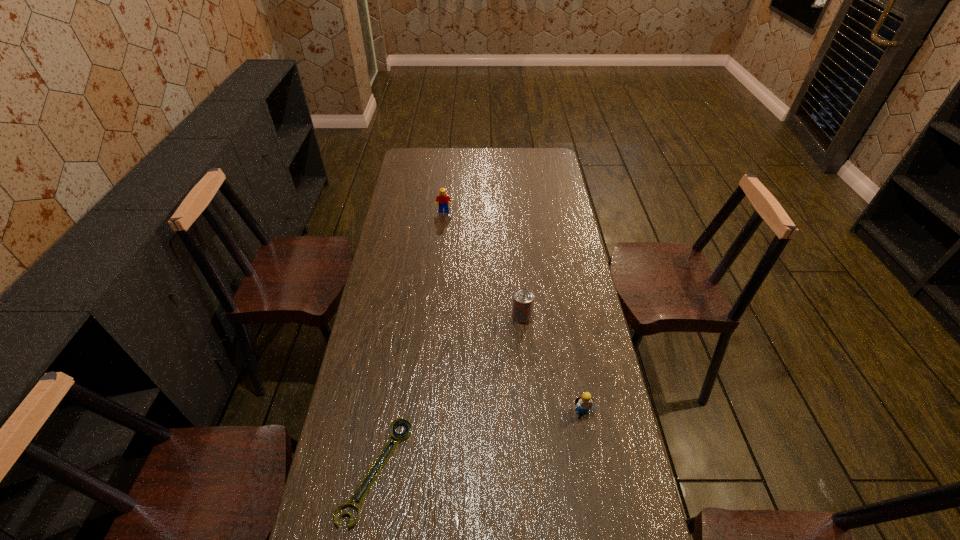
You are a GUI agent. You are given a task and a screenshot of the screen. Output one action in this format:
    pyautogui.click(x=<x>, y=<y>)
    Task: Click on the free spot between the shortest object and the rightmost object
    This screenshot has height=540, width=960.
    Given the screenshot: What is the action you would take?
    pyautogui.click(x=479, y=441)

Where is `unoccupied area between the third nearest object and the left Lego`? unoccupied area between the third nearest object and the left Lego is located at coordinates (483, 264).

Find the location of a particular element. The height and width of the screenshot is (540, 960). vacant space in between the nearest object and the second nearest object is located at coordinates (479, 441).

Find the location of a particular element. free space that is in between the nearer Lego and the third object from left to right is located at coordinates (552, 364).

The image size is (960, 540). I want to click on vacant space in between the third farthest object and the second farthest object, so click(552, 364).

Locate an element on the screen. The height and width of the screenshot is (540, 960). object that stands as the third closest to the beer can is located at coordinates (442, 199).

The width and height of the screenshot is (960, 540). I want to click on object that is the third closest to the left Lego, so click(x=584, y=401).

I want to click on vacant space that satisfies the following two spatial constraints: 1. on the front-facing side of the third nearest object; 2. on the left side of the farther Lego, so click(x=434, y=316).

Where is `free space that satisfies the following two spatial constraints: 1. on the front-facing side of the farther Lego; 2. on the left side of the beer can`? The width and height of the screenshot is (960, 540). free space that satisfies the following two spatial constraints: 1. on the front-facing side of the farther Lego; 2. on the left side of the beer can is located at coordinates tap(434, 316).

Where is `vacant space that satisfies the following two spatial constraints: 1. on the front-facing side of the farthest object; 2. on the right side of the second object from right to left`? This screenshot has height=540, width=960. vacant space that satisfies the following two spatial constraints: 1. on the front-facing side of the farthest object; 2. on the right side of the second object from right to left is located at coordinates (434, 316).